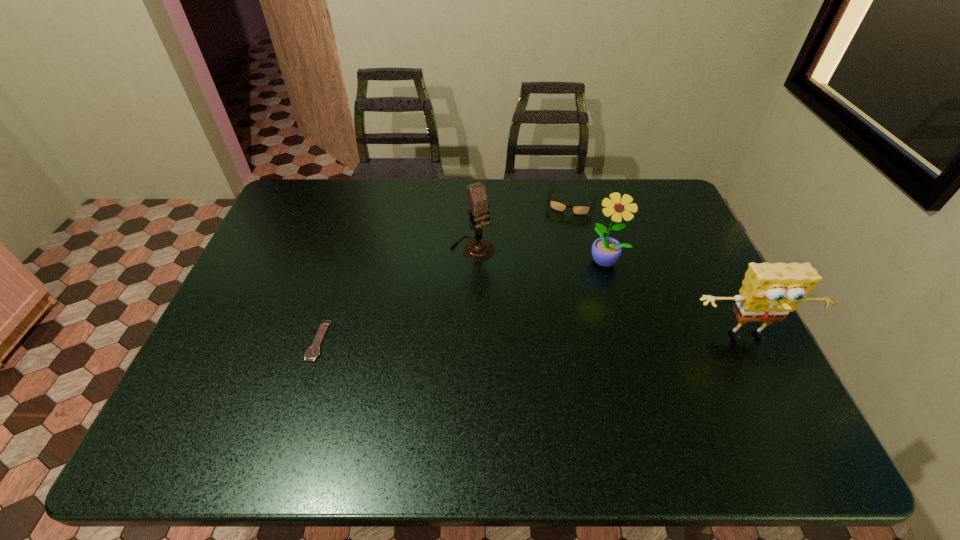
This screenshot has height=540, width=960. Identify the location of vacant space at the far edge of the desktop. pos(386,183).

Locate an element on the screen. This screenshot has width=960, height=540. vacant space at the left edge of the desktop is located at coordinates (268, 266).

In order to click on vacant space at the right edge in this screenshot , I will do `click(699, 266)`.

I want to click on vacant space at the near left corner of the desktop, so click(232, 373).

In the image, there is a desktop. In order to click on vacant space at the far right corner in this screenshot , I will do `click(665, 199)`.

Locate an element on the screen. This screenshot has height=540, width=960. unoccupied position between the second object from left to right and the watch is located at coordinates (396, 294).

Locate an element on the screen. empty space that is in between the watch and the sunflower is located at coordinates (462, 300).

The image size is (960, 540). Find the location of `vacant area between the leftmost object and the sunflower`. vacant area between the leftmost object and the sunflower is located at coordinates (462, 300).

Where is `vacant space that's between the farthest object and the shortest object`? The height and width of the screenshot is (540, 960). vacant space that's between the farthest object and the shortest object is located at coordinates (445, 269).

Find the location of a particular element. Image resolution: width=960 pixels, height=540 pixels. vacant region between the sunflower and the rightmost object is located at coordinates (677, 300).